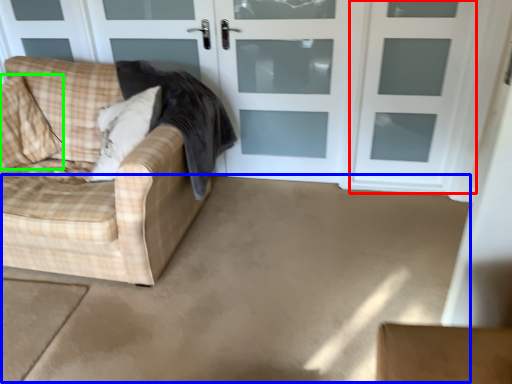
Question: Which is nearer to the screen door (highlighted by a red box)? concrete (highlighted by a blue box) or pillow (highlighted by a green box).

Choices:
 (A) concrete
 (B) pillow

Answer: (A)